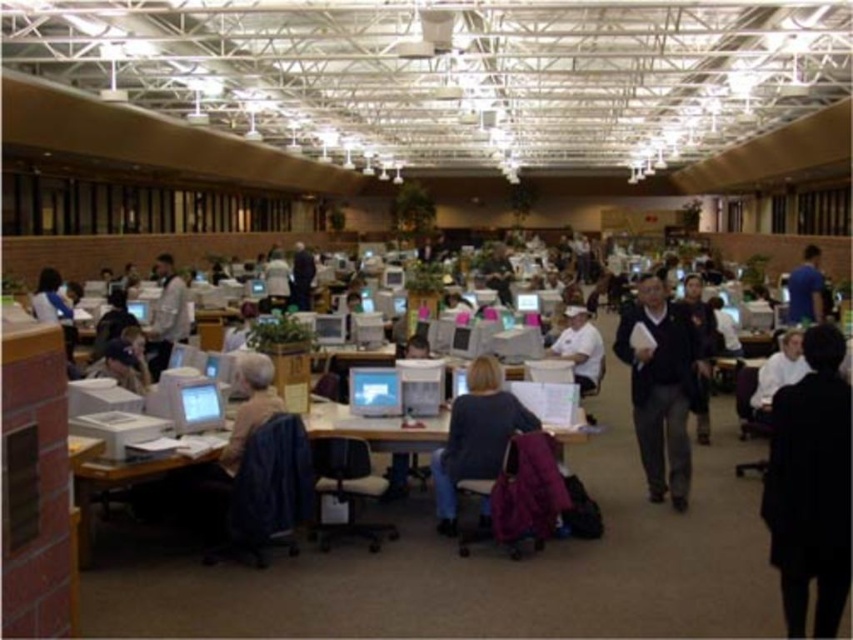
You are a maintenance worker in the library. You need to move a 2.5 meter long extension cord from the dark gray sweater at center to the matte gray computer at center. Can you do it without bending the cord?

The distance between the dark gray sweater at center and the matte gray computer at center is 2.69 meters. Since the extension cord is only 2.5 meters long, it is not long enough to reach without bending.

You are a person sitting at a desk in the library. You need to place your matte black laptop at left on top of the blue denim jeans at center. Is this possible based on their sizes?

The blue denim jeans at center has a greater height compared to matte black laptop at left, so placing the matte black laptop at left on top of the blue denim jeans at center may be possible as the jeans are taller. However, this depends on the stability and surface area of the jeans to support the laptop.

You are standing in the library and want to determine which of the two points, point (451, 410) or point (141, 376), is closer to you. Based on the scene description, which point is nearer?

Point (451, 410) is closer to the camera than point (141, 376), so it is nearer to you.